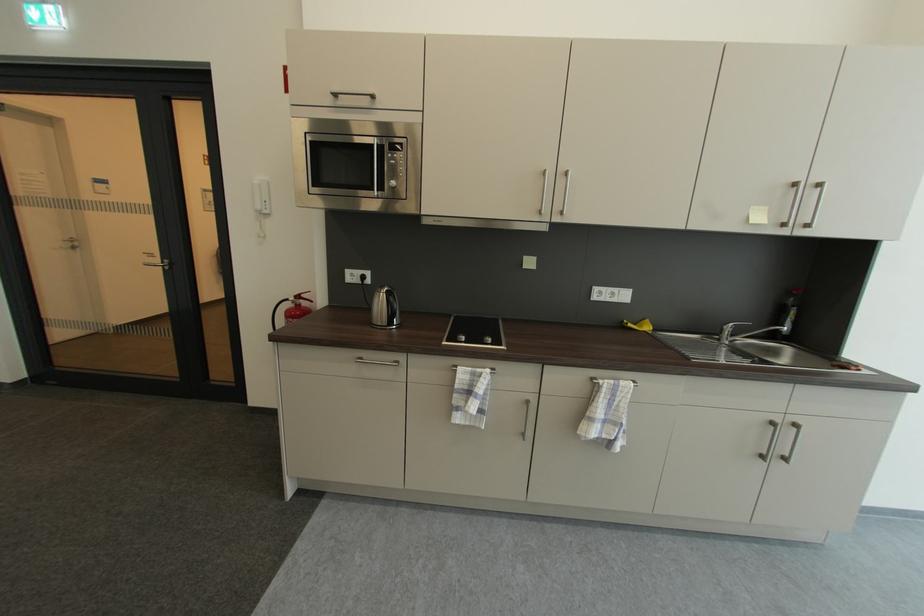
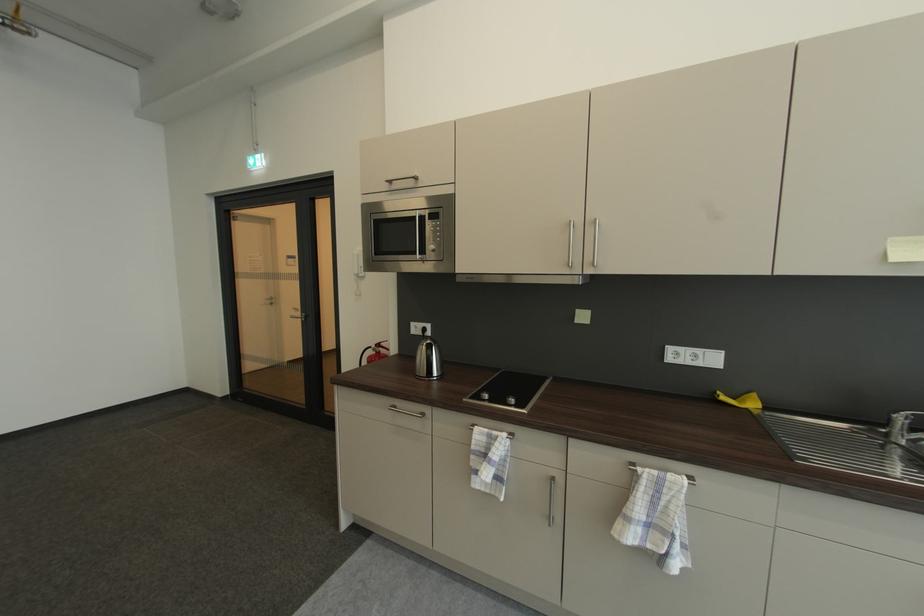
In the second image, find the point that corresponds to the point at 387,188 in the first image.

(430, 254)